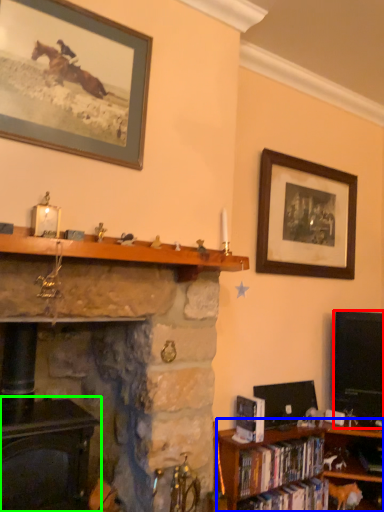
Question: Estimate the real-world distances between objects in this image. Which object is farther from television (highlighted by a red box), bookcase (highlighted by a blue box) or fireplace (highlighted by a green box)?

Choices:
 (A) bookcase
 (B) fireplace

Answer: (B)